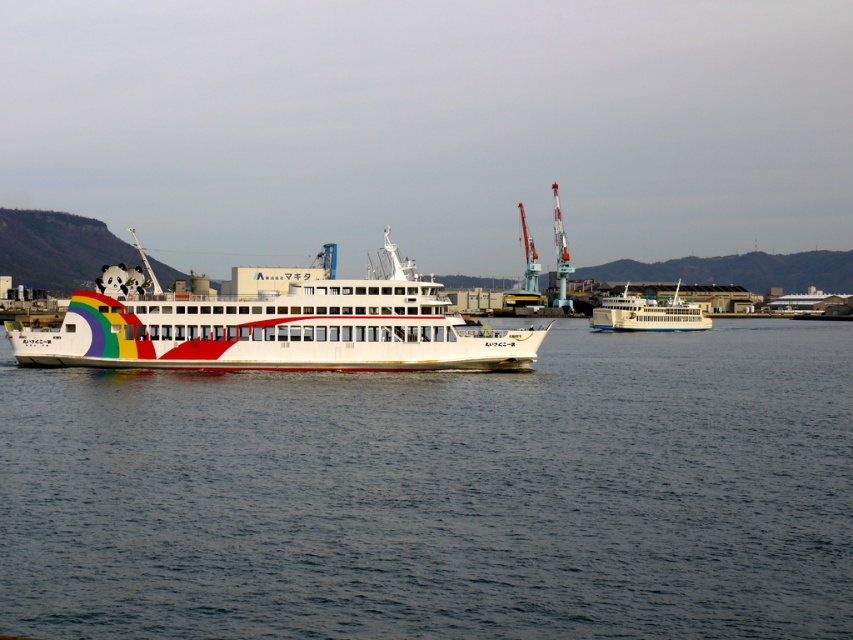
Between clear blue water at center and white glossy ferry at center, which one is positioned lower?

clear blue water at center

Is clear blue water at center wider than white glossy ferry at center?

Indeed, clear blue water at center has a greater width compared to white glossy ferry at center.

Which is in front, point (248, 612) or point (700, 314)?

Positioned in front is point (248, 612).

The image size is (853, 640). What are the coordinates of `clear blue water at center` in the screenshot? It's located at (440, 493).

Does rainbow painted ship at center appear on the right side of white glossy ferry at center?

Incorrect, rainbow painted ship at center is not on the right side of white glossy ferry at center.

Who is lower down, rainbow painted ship at center or white glossy ferry at center?

white glossy ferry at center

Is point (109, 307) in front of point (695, 321)?

Yes, point (109, 307) is in front of point (695, 321).

Where is `rainbow painted ship at center`? Image resolution: width=853 pixels, height=640 pixels. rainbow painted ship at center is located at coordinates (270, 326).

Does clear blue water at center have a greater height compared to rainbow painted ship at center?

No.

Can you confirm if clear blue water at center is bigger than rainbow painted ship at center?

No, clear blue water at center is not bigger than rainbow painted ship at center.

Image resolution: width=853 pixels, height=640 pixels. I want to click on clear blue water at center, so click(440, 493).

In order to click on clear blue water at center in this screenshot , I will do `click(440, 493)`.